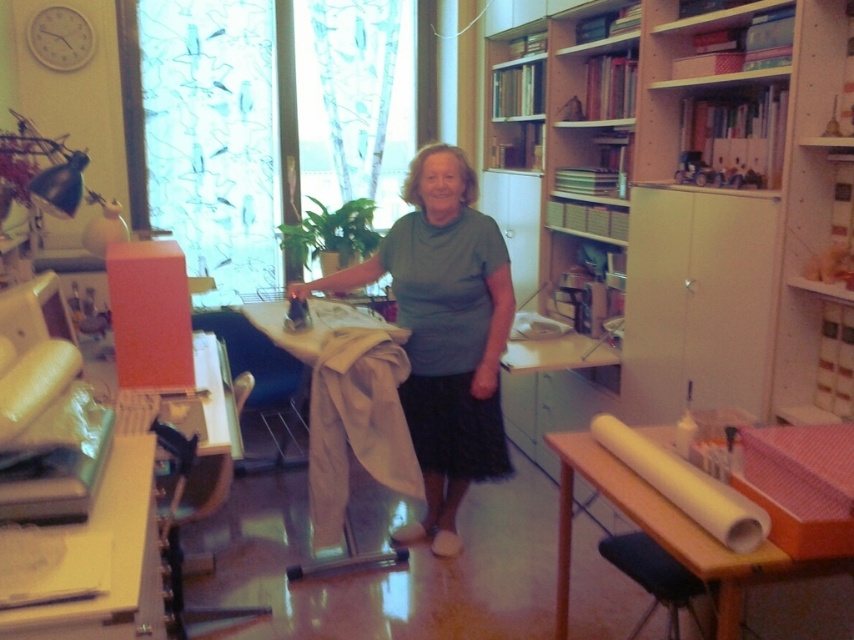
Question: Which point is closer to the camera?

Choices:
 (A) green cotton shirt at center
 (B) dark blue fabric stool at lower right
 (C) wooden table at lower right

Answer: (C)

Question: Which point is closer to the camera?

Choices:
 (A) dark blue fabric stool at lower right
 (B) green cotton shirt at center

Answer: (A)

Question: Observing the image, what is the correct spatial positioning of wooden table at lower right in reference to dark blue fabric stool at lower right?

Choices:
 (A) right
 (B) left

Answer: (B)

Question: Can you confirm if wooden table at lower right is thinner than wooden table at lower left?

Choices:
 (A) yes
 (B) no

Answer: (B)

Question: Which of the following is the farthest from the observer?

Choices:
 (A) (322, 428)
 (B) (71, 618)
 (C) (670, 634)
 (D) (560, 440)

Answer: (A)

Question: In this image, where is green cotton shirt at center located relative to wooden table at lower left?

Choices:
 (A) left
 (B) right

Answer: (B)